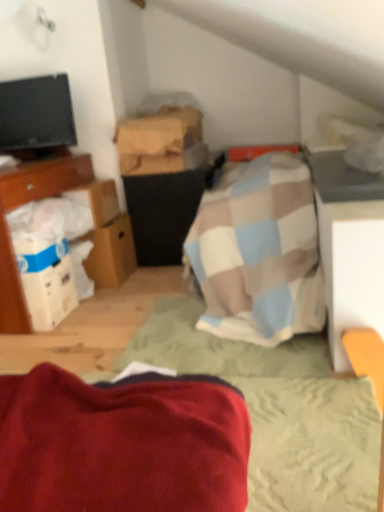
Question: Is white cardboard box at center-left, which is counted as the 1th cardboard box, starting from the bottom, oriented towards black glossy tv at upper left?

Choices:
 (A) no
 (B) yes

Answer: (A)

Question: Is white cardboard box at center-left, which is counted as the 1th cardboard box, starting from the bottom, to the left of black glossy tv at upper left from the viewer's perspective?

Choices:
 (A) no
 (B) yes

Answer: (A)

Question: Can you confirm if white cardboard box at center-left, positioned as the 3th cardboard box in top-to-bottom order, is bigger than black glossy tv at upper left?

Choices:
 (A) no
 (B) yes

Answer: (A)

Question: Is white cardboard box at center-left, which is counted as the 1th cardboard box, starting from the bottom, surrounding black glossy tv at upper left?

Choices:
 (A) no
 (B) yes

Answer: (A)

Question: Is white cardboard box at center-left, which is counted as the 1th cardboard box, starting from the bottom, taller than black glossy tv at upper left?

Choices:
 (A) yes
 (B) no

Answer: (B)

Question: Considering the positions of wooden bed frame at center and white cardboard boxes at left in the image, is wooden bed frame at center wider or thinner than white cardboard boxes at left?

Choices:
 (A) wide
 (B) thin

Answer: (A)

Question: Is wooden bed frame at center situated inside white cardboard boxes at left or outside?

Choices:
 (A) outside
 (B) inside

Answer: (A)

Question: From their relative heights in the image, would you say wooden bed frame at center is taller or shorter than white cardboard boxes at left?

Choices:
 (A) short
 (B) tall

Answer: (A)

Question: Does point (289, 414) appear closer or farther from the camera than point (1, 226)?

Choices:
 (A) farther
 (B) closer

Answer: (B)

Question: Based on their positions, is white cardboard box at center-left, positioned as the 3th cardboard box in top-to-bottom order, located to the left or right of black glossy tv at upper left?

Choices:
 (A) left
 (B) right

Answer: (B)

Question: Is point click(x=102, y=220) positioned closer to the camera than point click(x=44, y=119)?

Choices:
 (A) closer
 (B) farther

Answer: (A)

Question: Is white cardboard box at center-left, positioned as the 3th cardboard box in top-to-bottom order, bigger or smaller than black glossy tv at upper left?

Choices:
 (A) small
 (B) big

Answer: (A)

Question: Is white cardboard box at center-left, positioned as the 3th cardboard box in top-to-bottom order, inside or outside of black glossy tv at upper left?

Choices:
 (A) inside
 (B) outside

Answer: (B)

Question: Is white cardboard boxes at left in front of or behind wooden bed frame at center in the image?

Choices:
 (A) behind
 (B) front

Answer: (A)

Question: Is white cardboard boxes at left spatially inside wooden bed frame at center, or outside of it?

Choices:
 (A) outside
 (B) inside

Answer: (A)